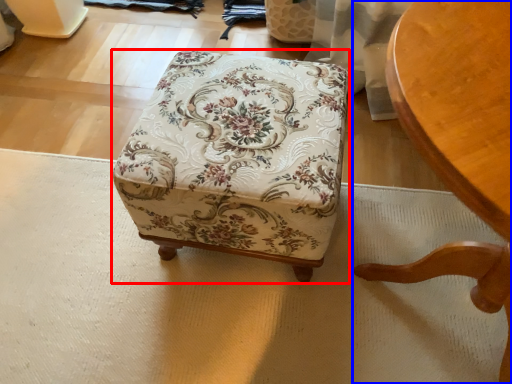
Question: Which of the following is the farthest to the observer, furniture (highlighted by a red box) or chair (highlighted by a blue box)?

Choices:
 (A) furniture
 (B) chair

Answer: (A)